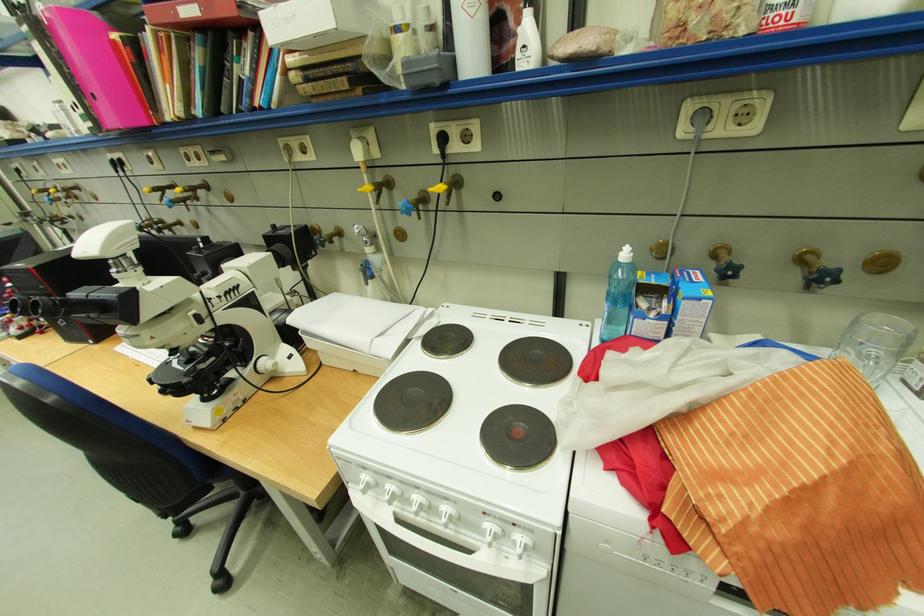
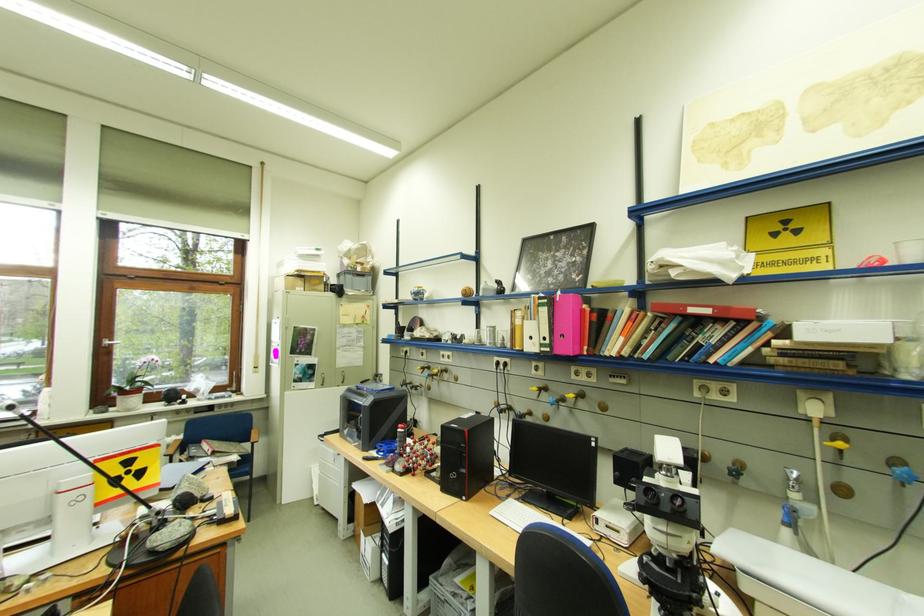
In the second image, find the point that corresponds to (x=139, y=334) in the first image.

(681, 533)